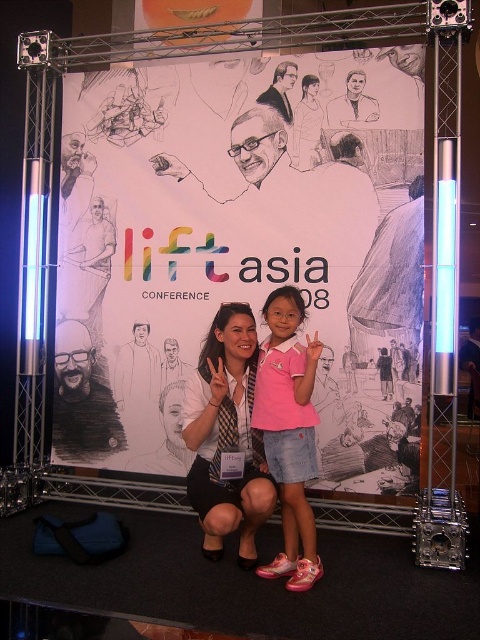
Question: Among these objects, which one is nearest to the camera?

Choices:
 (A) matte black blazer at center
 (B) pink matte shirt at center

Answer: (A)

Question: Is matte black blazer at center positioned before pink matte shirt at center?

Choices:
 (A) yes
 (B) no

Answer: (A)

Question: Is the position of matte black blazer at center less distant than that of pink matte shirt at center?

Choices:
 (A) yes
 (B) no

Answer: (A)

Question: Is matte black blazer at center above pink matte shirt at center?

Choices:
 (A) no
 (B) yes

Answer: (A)

Question: Which object appears closest to the camera in this image?

Choices:
 (A) pink matte shirt at center
 (B) matte black blazer at center

Answer: (B)